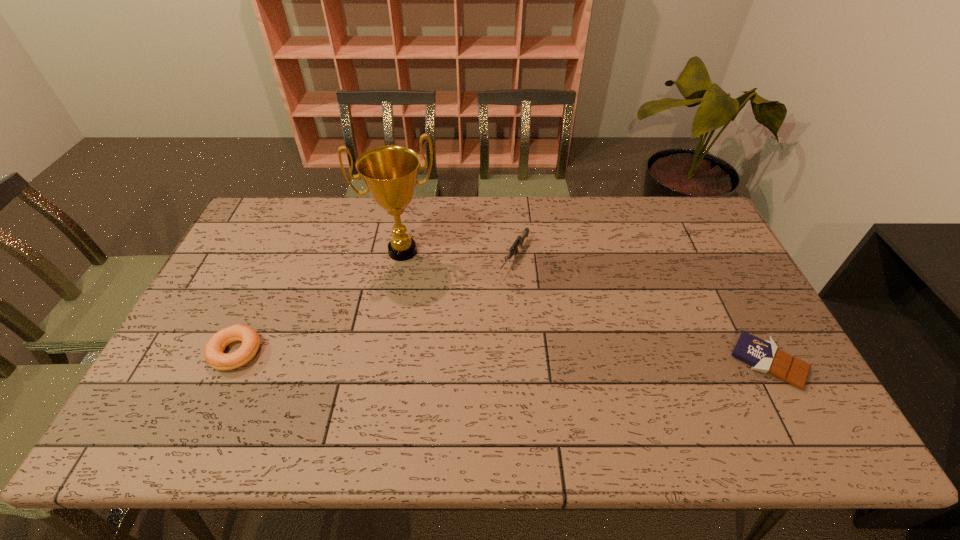
The image size is (960, 540). I want to click on free space between the shortest object and the third object from right to left, so click(x=586, y=307).

Identify the location of free space between the award and the gun. (459, 254).

Locate an element on the screen. blank region between the leftmost object and the award is located at coordinates (319, 301).

Image resolution: width=960 pixels, height=540 pixels. Identify the location of vacant space that is in between the gun and the award. click(459, 254).

Identify the location of free space that is in between the award and the chocolate bar. (586, 307).

At what (x,y) coordinates should I click in order to perform the action: click on free space between the second tallest object and the tallest object. Please return your answer as a coordinate pair (x, y). Image resolution: width=960 pixels, height=540 pixels. Looking at the image, I should click on (459, 254).

Locate an element on the screen. This screenshot has height=540, width=960. free space that is in between the rightmost object and the gun is located at coordinates (641, 309).

The image size is (960, 540). Identify the location of empty location between the chocolate bar and the second object from left to right. (586, 307).

The image size is (960, 540). What are the coordinates of `free space between the third tallest object and the second tallest object` in the screenshot? It's located at (375, 304).

Identify which object is the third nearest to the chocolate bar. Please provide its 2D coordinates. Your answer should be formatted as a tuple, i.e. [(x, y)], where the tuple contains the x and y coordinates of a point satisfying the conditions above.

[(214, 348)]